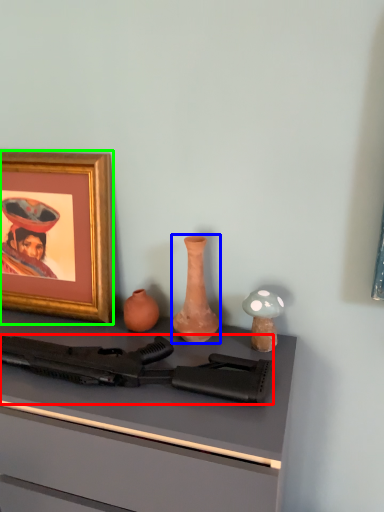
Question: Which object is the farthest from rifle (highlighted by a red box)? Choose among these: vase (highlighted by a blue box) or picture frame (highlighted by a green box).

Choices:
 (A) vase
 (B) picture frame

Answer: (B)